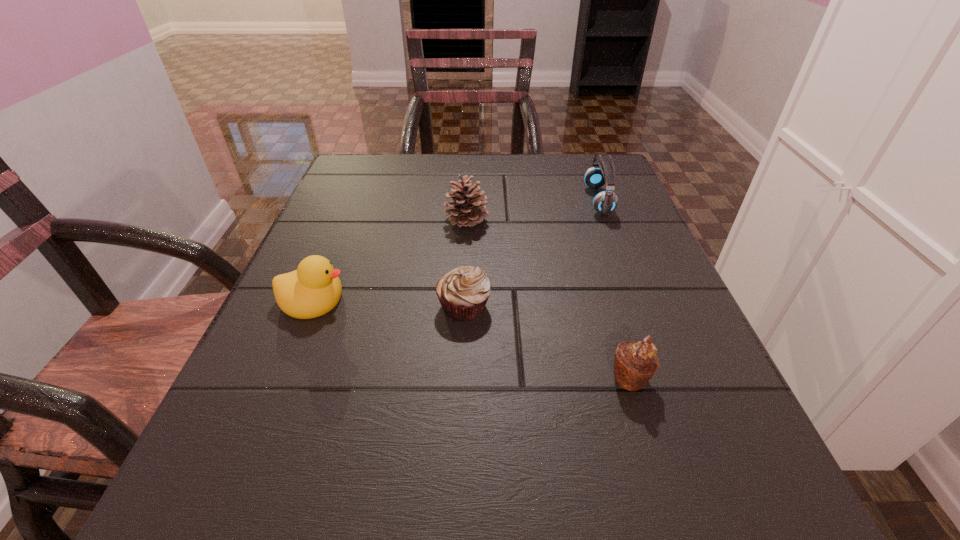
Locate an element on the screen. headset is located at coordinates (605, 202).

Image resolution: width=960 pixels, height=540 pixels. Find the location of `pinecone`. pinecone is located at coordinates (470, 209).

Identify the location of the leftmost object. tap(314, 289).

Locate an element on the screen. Image resolution: width=960 pixels, height=540 pixels. the nearest object is located at coordinates (635, 363).

The width and height of the screenshot is (960, 540). In order to click on the taller muffin in this screenshot , I will do tap(635, 363).

Find the location of `the shorter muffin`. the shorter muffin is located at coordinates (463, 292).

In order to click on the shortest object in this screenshot , I will do `click(463, 292)`.

At what (x,y) coordinates should I click in order to perform the action: click on free space located on the ear cups of the headset. Please return your answer as a coordinate pair (x, y). Looking at the image, I should click on (561, 200).

At what (x,y) coordinates should I click in order to perform the action: click on vacant space located 0.280m on the ear cups of the headset. Please return your answer as a coordinate pair (x, y). Looking at the image, I should click on (463, 200).

Locate an element on the screen. The image size is (960, 540). free spot located on the ear cups of the headset is located at coordinates (415, 200).